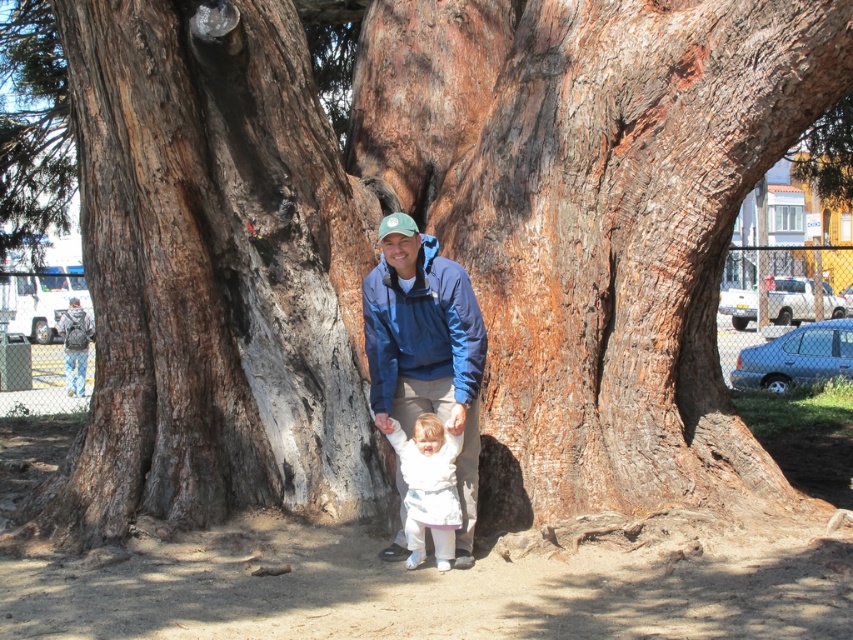
Is dark brown rough bark at center to the left of white soft baby at center from the viewer's perspective?

Yes, dark brown rough bark at center is to the left of white soft baby at center.

Locate an element on the screen. The width and height of the screenshot is (853, 640). dark brown rough bark at center is located at coordinates (212, 276).

The image size is (853, 640). I want to click on dark brown rough bark at center, so click(212, 276).

Does dark brown rough bark at center lie behind blue fabric jacket at center?

Yes.

Is dark brown rough bark at center to the right of blue fabric jacket at center from the viewer's perspective?

In fact, dark brown rough bark at center is to the left of blue fabric jacket at center.

This screenshot has height=640, width=853. In order to click on dark brown rough bark at center in this screenshot , I will do `click(212, 276)`.

Who is more forward, [397,337] or [431,436]?

Point [431,436] is in front.

Identify the location of blue fabric jacket at center. (425, 349).